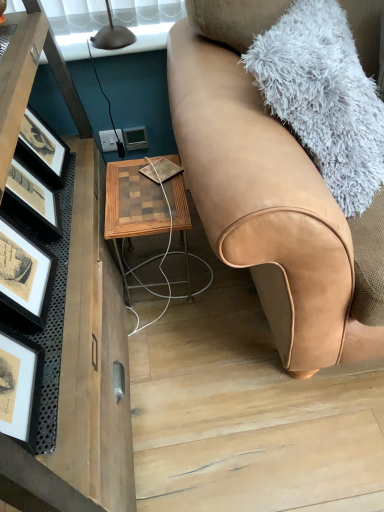
The height and width of the screenshot is (512, 384). Identify the location of free point above woodenmaterial/texturetable at center (from a real-world perspective). (147, 187).